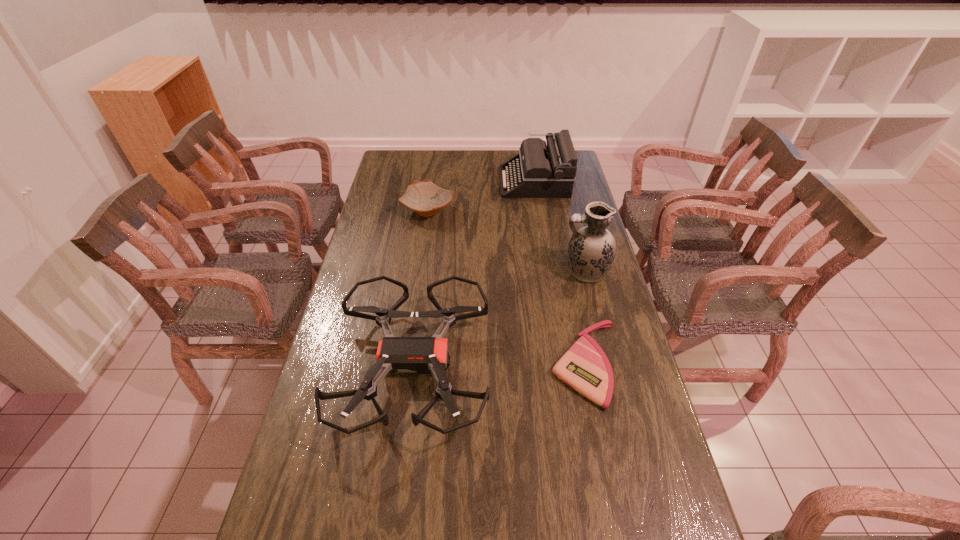
Locate an element on the screen. This screenshot has width=960, height=540. vase is located at coordinates (592, 249).

Identify the location of the third farthest object. (592, 249).

Where is `the second tallest object`? The image size is (960, 540). the second tallest object is located at coordinates (539, 171).

Image resolution: width=960 pixels, height=540 pixels. Identify the location of drone. (425, 355).

Where is `pottery`? pottery is located at coordinates (425, 198).

Image resolution: width=960 pixels, height=540 pixels. Find the location of `wristlet`. wristlet is located at coordinates (585, 367).

What are the coordinates of `free space located 0.050m with the handle on the side of the third nearest object` in the screenshot? It's located at tap(547, 271).

Find the location of a particular element. This screenshot has width=960, height=540. free location located with the handle on the side of the third nearest object is located at coordinates (448, 271).

The image size is (960, 540). What are the coordinates of `free space located with the handle on the side of the third nearest object` in the screenshot? It's located at (454, 271).

In order to click on blank space located 0.180m on the typing side of the second tallest object in this screenshot , I will do `click(460, 181)`.